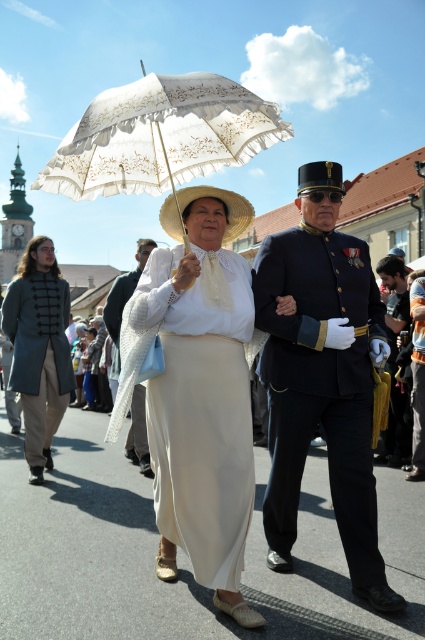
Question: Is matte white dress at center positioned in front of matte white lace parasol at center?

Choices:
 (A) yes
 (B) no

Answer: (A)

Question: Which of the following is the farthest from the observer?

Choices:
 (A) (5, 307)
 (B) (237, 221)
 (C) (283, 140)

Answer: (A)

Question: Is matte white dress at center to the left of yellow fabric mask at right from the viewer's perspective?

Choices:
 (A) yes
 (B) no

Answer: (A)

Question: Which point is farther to the camera?

Choices:
 (A) white lace umbrella at center
 (B) matte white lace parasol at center
 (C) matte white dress at center
 (D) shiny dark blue uniform at center

Answer: (B)

Question: From the image, what is the correct spatial relationship of shiny dark blue uniform at center in relation to white lace dress at center?

Choices:
 (A) right
 (B) left

Answer: (A)

Question: Among these points, which one is nearest to the camera?

Choices:
 (A) (220, 348)
 (B) (62, 321)
 (C) (215, 193)
 (D) (144, 248)

Answer: (A)